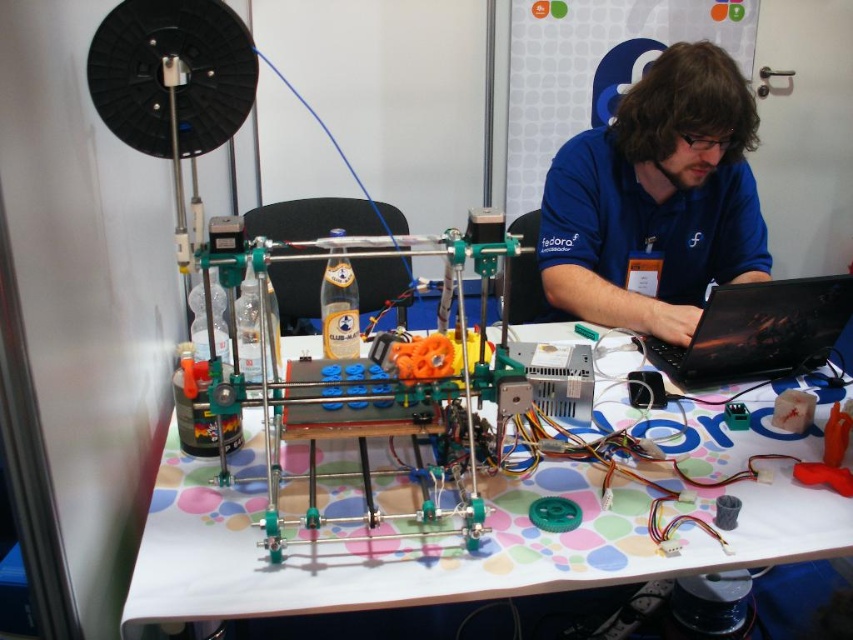
Does polka dot tablecloth at center appear over blue fabric shirt at center?

No.

The width and height of the screenshot is (853, 640). In order to click on polka dot tablecloth at center in this screenshot , I will do `click(448, 552)`.

Looking at this image, does polka dot tablecloth at center have a greater width compared to black glossy laptop at center?

Yes.

Locate an element on the screen. The width and height of the screenshot is (853, 640). polka dot tablecloth at center is located at coordinates (448, 552).

Where is `polka dot tablecloth at center`? polka dot tablecloth at center is located at coordinates (448, 552).

Which is more to the right, blue fabric shirt at center or black glossy laptop at center?

black glossy laptop at center

Measure the distance between blue fabric shirt at center and camera.

blue fabric shirt at center is 1.38 meters away from camera.

Image resolution: width=853 pixels, height=640 pixels. Identify the location of blue fabric shirt at center. (657, 198).